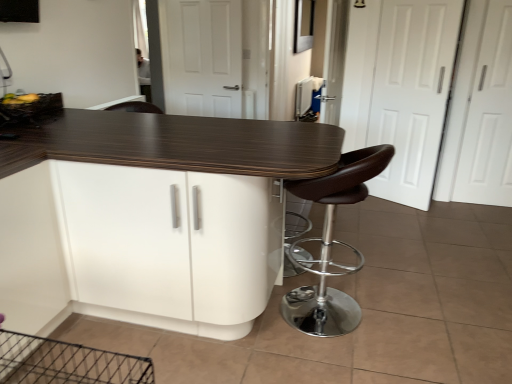
Question: Which direction should I rotate to look at white matte door at center, which is the first screen door from left to right?

Choices:
 (A) right
 (B) left

Answer: (B)

Question: Is brown leather stool at right positioned with its back to white matte door at right, placed as the second screen door when sorted from left to right?

Choices:
 (A) yes
 (B) no

Answer: (B)

Question: Does brown leather stool at right have a lesser height compared to white matte door at right, placed as the second screen door when sorted from left to right?

Choices:
 (A) no
 (B) yes

Answer: (B)

Question: Is brown leather stool at right outside of white matte door at right, placed as the second screen door when sorted from left to right?

Choices:
 (A) no
 (B) yes

Answer: (B)

Question: From a real-world perspective, is brown leather stool at right physically below white matte door at right, placed as the second screen door when sorted from left to right?

Choices:
 (A) no
 (B) yes

Answer: (B)

Question: Considering the relative sizes of brown leather stool at right and white matte door at right, placed as the second screen door when sorted from left to right, in the image provided, is brown leather stool at right wider than white matte door at right, placed as the second screen door when sorted from left to right,?

Choices:
 (A) no
 (B) yes

Answer: (B)

Question: Considering the relative positions of brown leather stool at right and white matte door at right, the 2th screen door from the right, in the image provided, is brown leather stool at right behind white matte door at right, the 2th screen door from the right,?

Choices:
 (A) no
 (B) yes

Answer: (A)

Question: Does brown leather stool at right appear on the right side of white matte screen door at right, the 3th screen door viewed from the left?

Choices:
 (A) yes
 (B) no

Answer: (B)

Question: Is brown leather stool at right at the left side of white matte screen door at right, acting as the first screen door starting from the right?

Choices:
 (A) yes
 (B) no

Answer: (A)

Question: Can you confirm if brown leather stool at right is smaller than white matte screen door at right, the 3th screen door viewed from the left?

Choices:
 (A) yes
 (B) no

Answer: (B)

Question: From the image's perspective, is brown leather stool at right located beneath white matte screen door at right, acting as the first screen door starting from the right?

Choices:
 (A) yes
 (B) no

Answer: (A)

Question: Can you confirm if brown leather stool at right is thinner than white matte screen door at right, acting as the first screen door starting from the right?

Choices:
 (A) yes
 (B) no

Answer: (B)

Question: Can you confirm if brown leather stool at right is taller than white matte screen door at right, the 3th screen door viewed from the left?

Choices:
 (A) no
 (B) yes

Answer: (A)

Question: Can you confirm if wooden textured basket at upper left is shorter than white matte door at center, which is the first screen door from left to right?

Choices:
 (A) no
 (B) yes

Answer: (B)